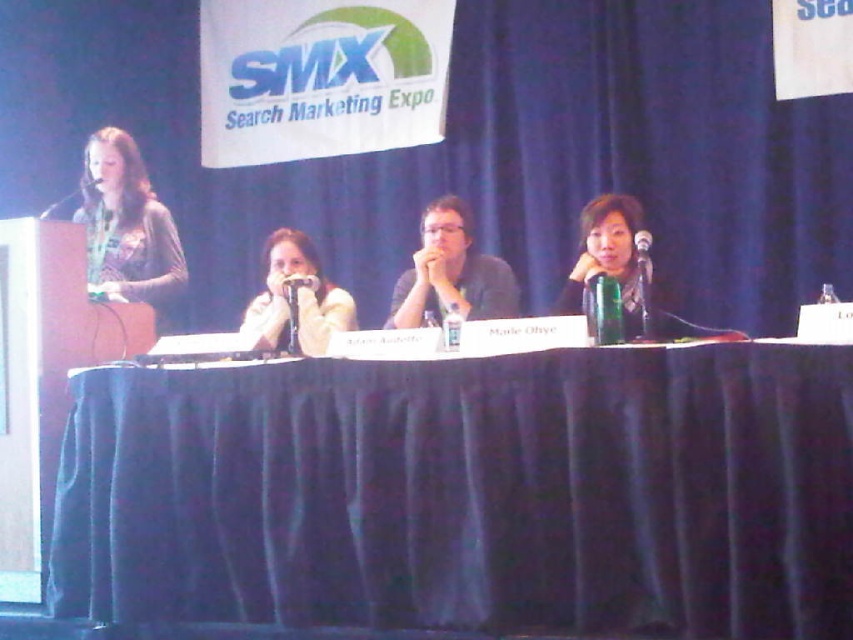
Question: Which is farther from the matte black hair at right?

Choices:
 (A) white fuzzy sweater at center
 (B) matte black shirt at center

Answer: (A)

Question: Does white fuzzy sweater at center have a lesser width compared to matte black hair at right?

Choices:
 (A) yes
 (B) no

Answer: (B)

Question: Among these points, which one is farthest from the camera?

Choices:
 (A) (268, 332)
 (B) (111, 451)
 (C) (599, 204)

Answer: (A)

Question: Can you confirm if black fabric table at center is positioned to the right of matte black shirt at center?

Choices:
 (A) yes
 (B) no

Answer: (B)

Question: Does black fabric table at center have a lesser width compared to white fuzzy sweater at center?

Choices:
 (A) no
 (B) yes

Answer: (A)

Question: Which object is the farthest from the black fabric table at center?

Choices:
 (A) black plastic microphone at upper center
 (B) white fuzzy sweater at center
 (C) matte black shirt at center

Answer: (A)